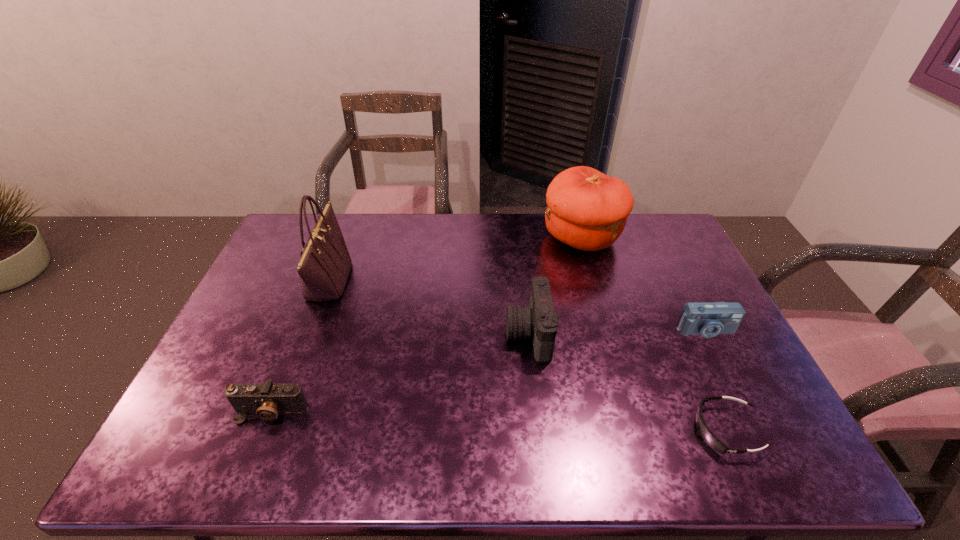
Locate an element on the screen. vacant space located 0.290m at the lens of the tallest camera is located at coordinates (406, 334).

Where is `free space located at the lens of the tallest camera`? free space located at the lens of the tallest camera is located at coordinates (420, 334).

This screenshot has height=540, width=960. Identify the location of free space located on the lens of the rightmost camera. (715, 353).

I want to click on free region located 0.050m on the front-facing side of the nearest camera, so click(x=257, y=446).

You are a GUI agent. You are given a task and a screenshot of the screen. Output one action in this format:
    pyautogui.click(x=<x>, y=<y>)
    Task: Click on the blank space located on the front and sides of the shortest object
    This screenshot has height=540, width=960.
    Given the screenshot: What is the action you would take?
    pyautogui.click(x=589, y=430)

I want to click on vacant space located on the front and sides of the shortest object, so click(577, 430).

Locate an element on the screen. blank space located 0.180m on the front and sides of the shortest object is located at coordinates (619, 430).

Locate an element on the screen. This screenshot has width=960, height=540. handbag present at the far edge is located at coordinates (324, 265).

Find the location of a particular element. The height and width of the screenshot is (540, 960). pumpkin at the far edge is located at coordinates (586, 209).

Identify the location of object present at the near edge. This screenshot has width=960, height=540. (709, 438).